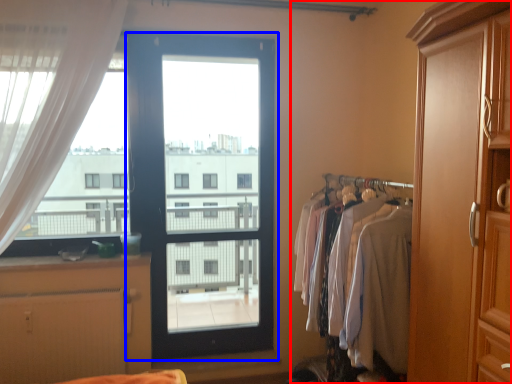
Question: Which point is closer to the camera, dresser (highlighted by a red box) or door (highlighted by a blue box)?

Choices:
 (A) dresser
 (B) door

Answer: (A)